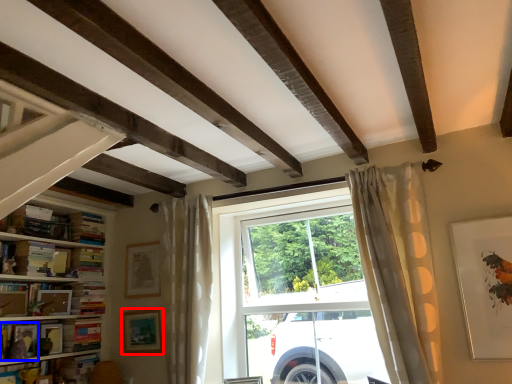
Question: Which point is closer to the camera, picture frame (highlighted by a red box) or book (highlighted by a blue box)?

Choices:
 (A) picture frame
 (B) book

Answer: (B)